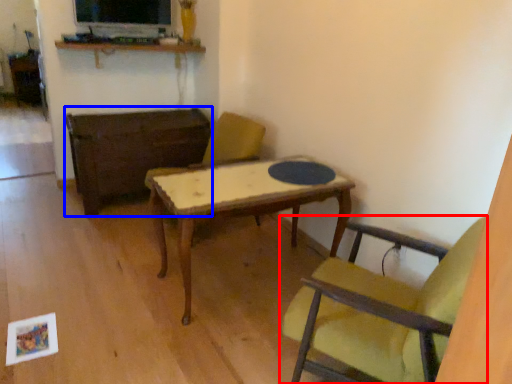
Question: Which point is further to the camera, chair (highlighted by a red box) or table (highlighted by a blue box)?

Choices:
 (A) chair
 (B) table

Answer: (B)